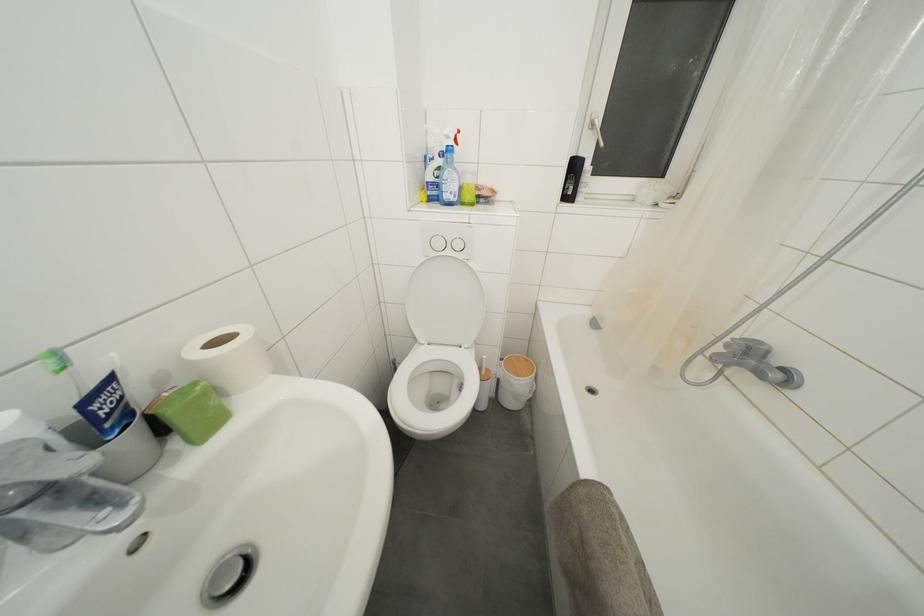
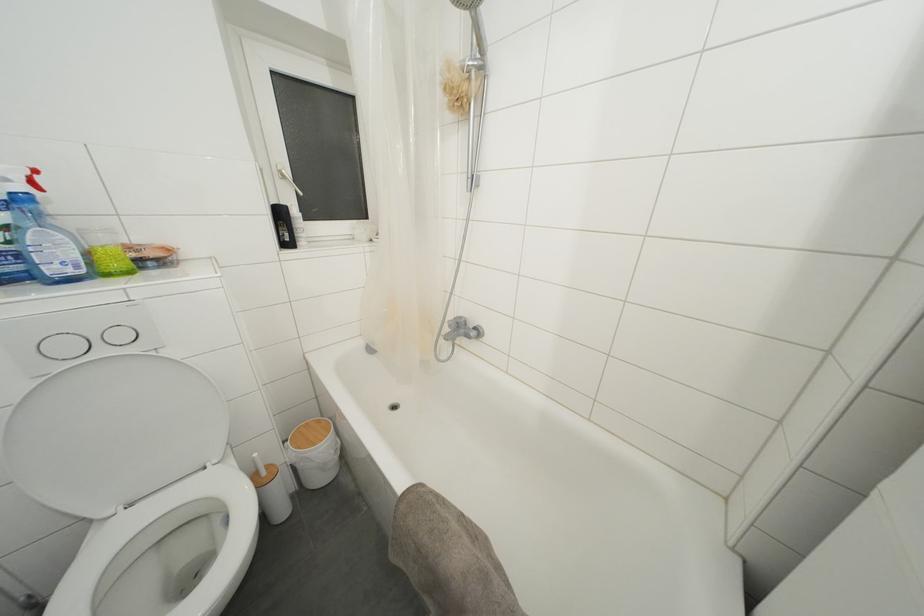
Where in the second image is the point corresponding to the point at 459,145 from the first image?

(37, 188)